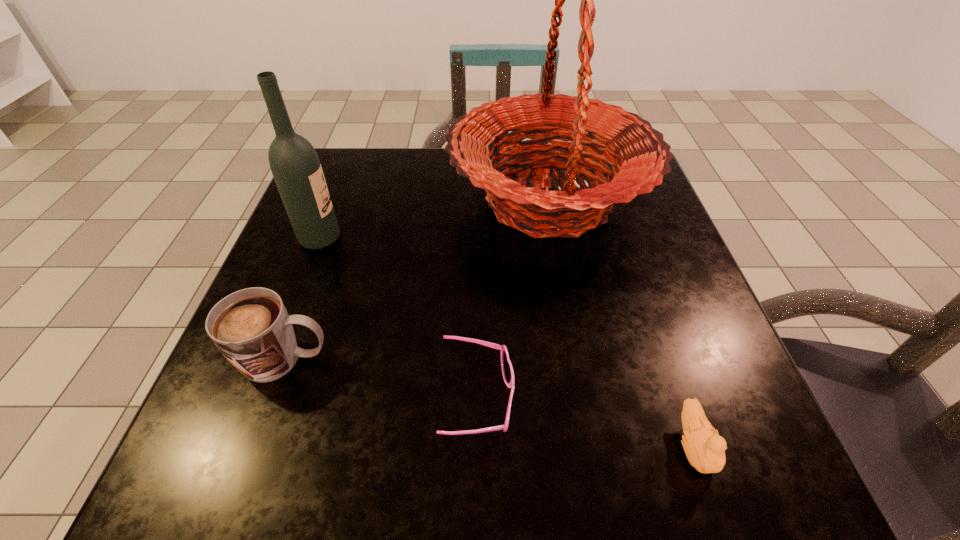
This screenshot has width=960, height=540. What are the coordinates of `free region at the left edge of the desktop` in the screenshot? It's located at (x=301, y=312).

Find the location of a particular element. This screenshot has width=960, height=540. vacant space at the right edge of the desktop is located at coordinates 648,227.

In the image, there is a desktop. Where is `vacant space at the far left corner`? The image size is (960, 540). vacant space at the far left corner is located at coordinates (347, 201).

In the image, there is a desktop. Find the location of `vacant space at the far right corner`. vacant space at the far right corner is located at coordinates (607, 174).

The image size is (960, 540). Find the location of `vacant space at the near right corner of the desktop`. vacant space at the near right corner of the desktop is located at coordinates (732, 448).

You are a GUI agent. You are given a task and a screenshot of the screen. Output one action in this format:
    pyautogui.click(x=<x>, y=<y>)
    Task: Click on the vacant space in between the duckling and the second tallest object
    The height and width of the screenshot is (540, 960).
    Given the screenshot: What is the action you would take?
    pyautogui.click(x=507, y=342)

I want to click on vacant area between the duckling and the fourth shortest object, so click(507, 342).

Identify the location of free space between the second shortest object and the wine bottle. This screenshot has height=540, width=960. (507, 342).

Where is `vacant space in between the second shortest object and the mug`? This screenshot has height=540, width=960. vacant space in between the second shortest object and the mug is located at coordinates (490, 402).

Where is `free space that is in between the duckling and the basket`? free space that is in between the duckling and the basket is located at coordinates (621, 323).